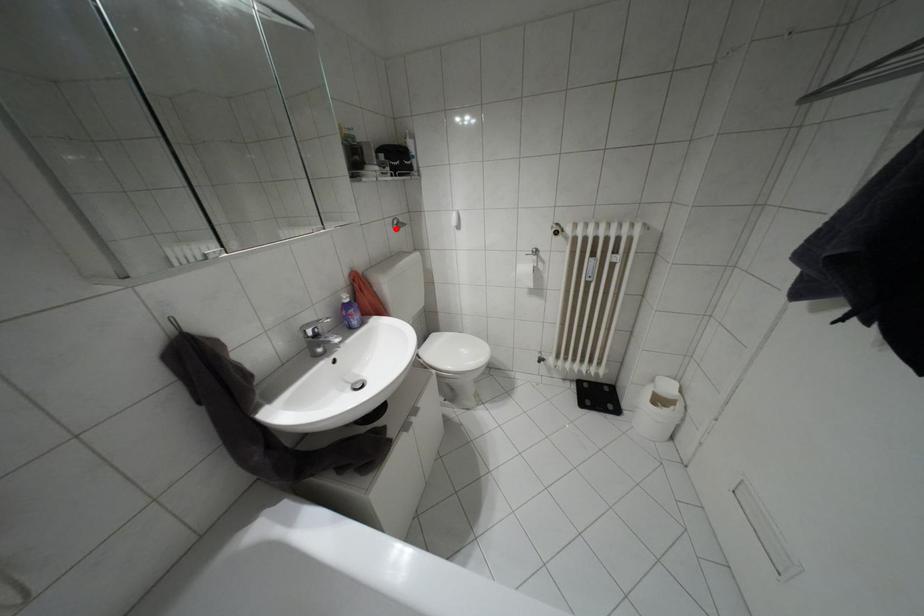
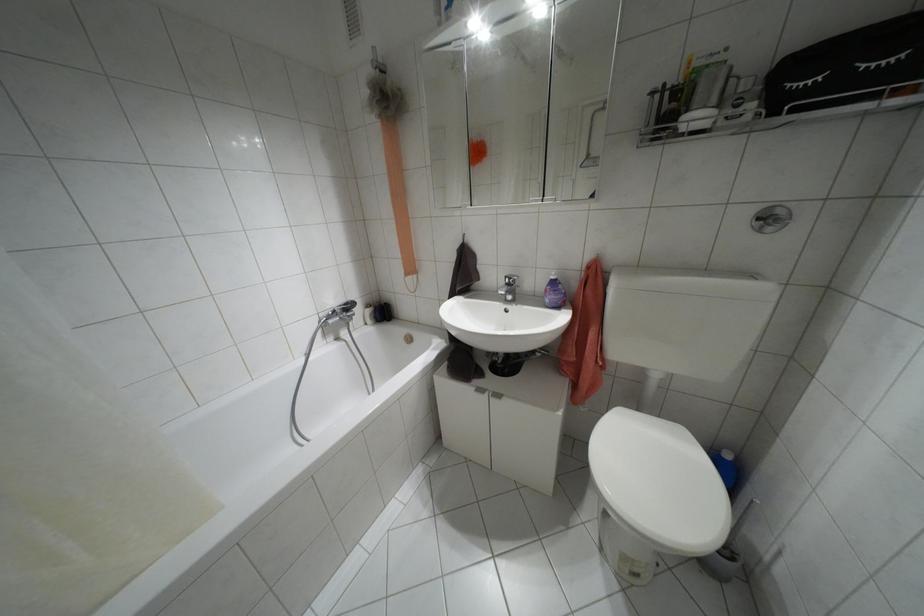
Question: I am providing you with two images of the same scene from different viewpoints. Image1 has a red point marked. In image2, the corresponding 3D location appears at what relative position? Reply with the corresponding letter.

Choices:
 (A) Closer
 (B) Farther

Answer: (B)